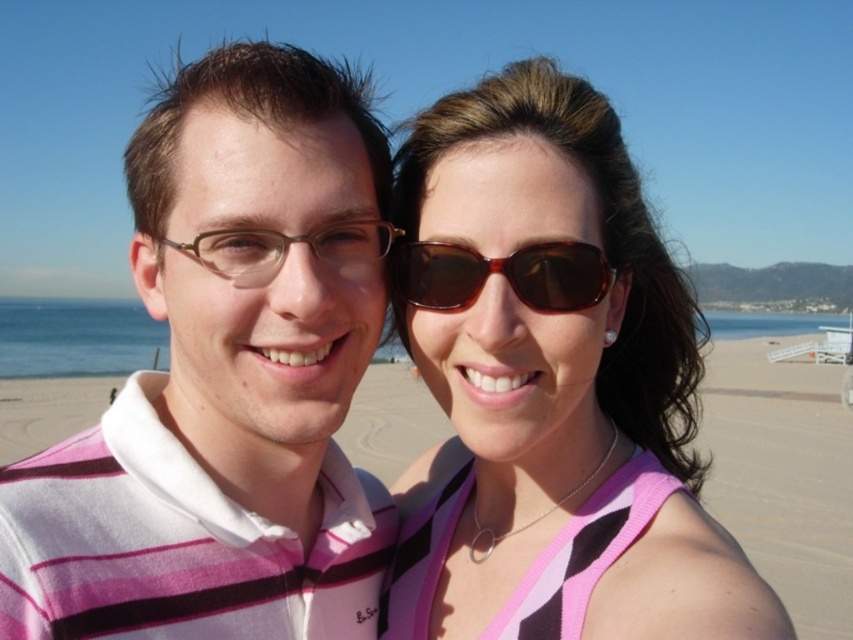
Question: Where is matte brown sunglasses at upper right located in relation to beige sand at center in the image?

Choices:
 (A) right
 (B) left

Answer: (B)

Question: Is matte brown sunglasses at upper right below brown tortoiseshell sunglasses at upper center?

Choices:
 (A) no
 (B) yes

Answer: (B)

Question: Which object is positioned closest to the beige sand at center?

Choices:
 (A) brown tortoiseshell sunglasses at upper center
 (B) matte brown sunglasses at upper right

Answer: (A)

Question: Which of the following is the farthest from the observer?

Choices:
 (A) brown tortoiseshell sunglasses at upper center
 (B) beige sand at center

Answer: (B)

Question: Which point appears closest to the camera in this image?

Choices:
 (A) (247, 234)
 (B) (457, 504)
 (C) (260, 236)

Answer: (A)

Question: Observing the image, what is the correct spatial positioning of brown tortoiseshell sunglasses at upper center in reference to brown matte glasses at center?

Choices:
 (A) above
 (B) below

Answer: (B)